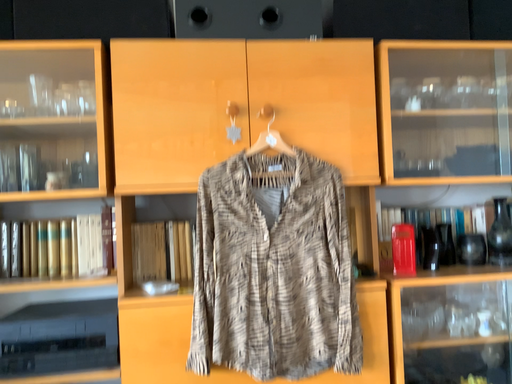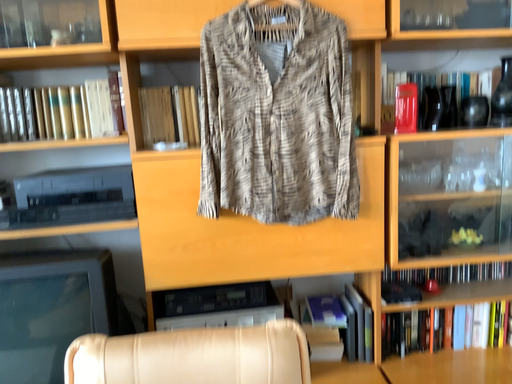
Question: How did the camera likely rotate when shooting the video?

Choices:
 (A) rotated downward
 (B) rotated upward

Answer: (A)